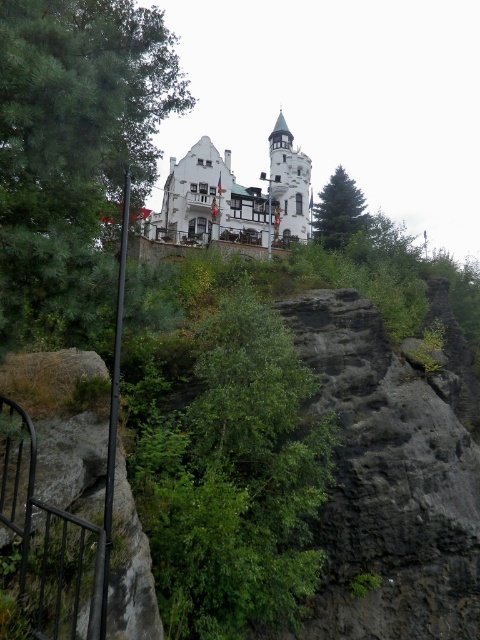
Question: Which of the following is the closest to the observer?

Choices:
 (A) green leafy tree at left
 (B) green matte tree at upper center
 (C) white stone castle at center

Answer: (A)

Question: Which point is farther to the camera?

Choices:
 (A) (351, 221)
 (B) (280, 138)
 (C) (21, 339)

Answer: (B)

Question: Is green leafy tree at left thinner than white stone castle at center?

Choices:
 (A) yes
 (B) no

Answer: (A)

Question: Is white stone castle at center smaller than green matte tree at upper center?

Choices:
 (A) yes
 (B) no

Answer: (B)

Question: In this image, where is green leafy tree at left located relative to white stone castle at center?

Choices:
 (A) above
 (B) below

Answer: (B)

Question: Estimate the real-world distances between objects in this image. Which object is closer to the white stone castle at center?

Choices:
 (A) green matte tree at upper center
 (B) green leafy tree at left

Answer: (A)